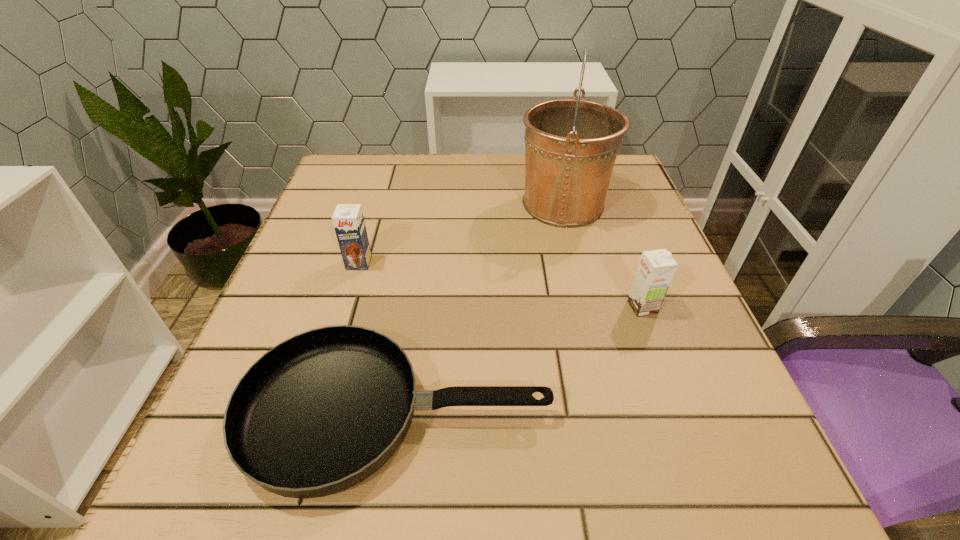
Where is `free space at the far edge of the desktop`? free space at the far edge of the desktop is located at coordinates (449, 153).

I want to click on vacant position at the near edge of the desktop, so click(x=396, y=455).

This screenshot has height=540, width=960. I want to click on blank space at the right edge of the desktop, so click(x=636, y=340).

In the image, there is a desktop. At what (x,y) coordinates should I click in order to perform the action: click on free space at the far left corner. Please return your answer as a coordinate pair (x, y). Image resolution: width=960 pixels, height=540 pixels. Looking at the image, I should click on (384, 194).

Identify the location of vacant space at the far right corner of the desktop. This screenshot has height=540, width=960. (616, 170).

Where is `free spot between the farther chocolate milk and the bucket`? Image resolution: width=960 pixels, height=540 pixels. free spot between the farther chocolate milk and the bucket is located at coordinates (461, 233).

At what (x,y) coordinates should I click in order to perform the action: click on vacant area that lies between the tallest object and the third farthest object. Please return your answer as a coordinate pair (x, y). Looking at the image, I should click on (603, 256).

At what (x,y) coordinates should I click in order to perform the action: click on vacant region between the right chocolate milk and the nearest object. Please return your answer as a coordinate pair (x, y). The image size is (960, 540). Looking at the image, I should click on (519, 361).

The width and height of the screenshot is (960, 540). In order to click on free point between the nearer chocolate milk and the tallest object in this screenshot , I will do `click(603, 256)`.

I want to click on free space between the nearest object and the bucket, so click(x=480, y=309).